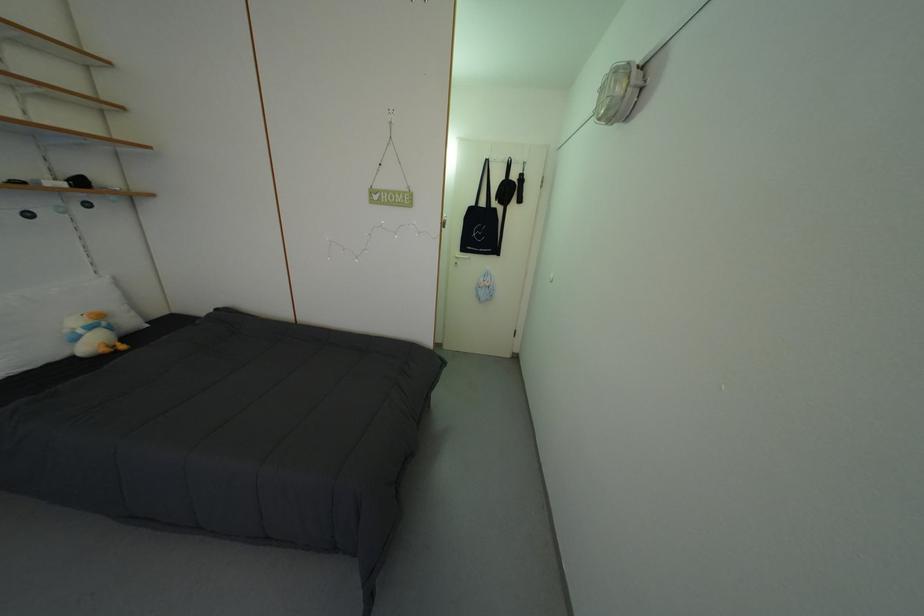
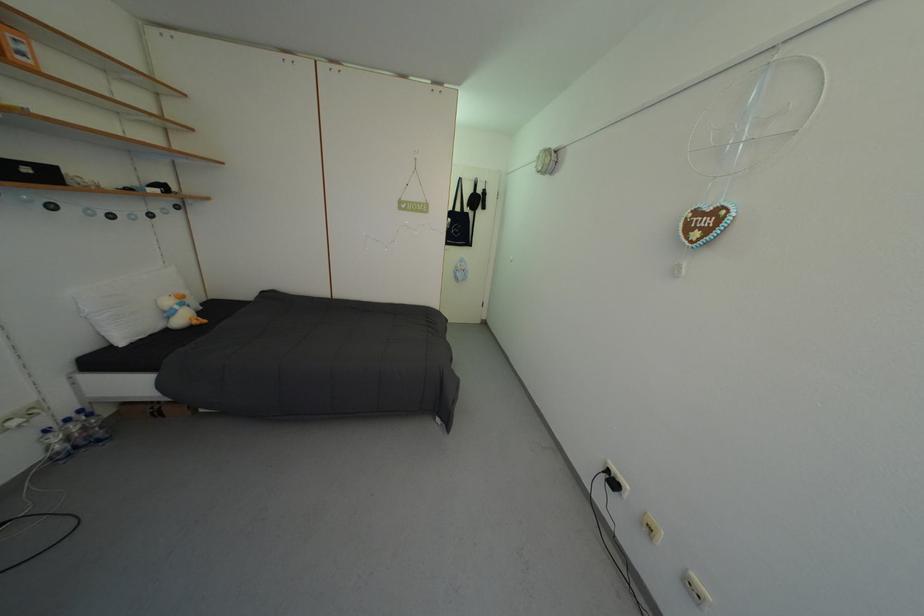
Where in the second image is the point corresponding to pixel 110 322 from the first image?

(190, 302)